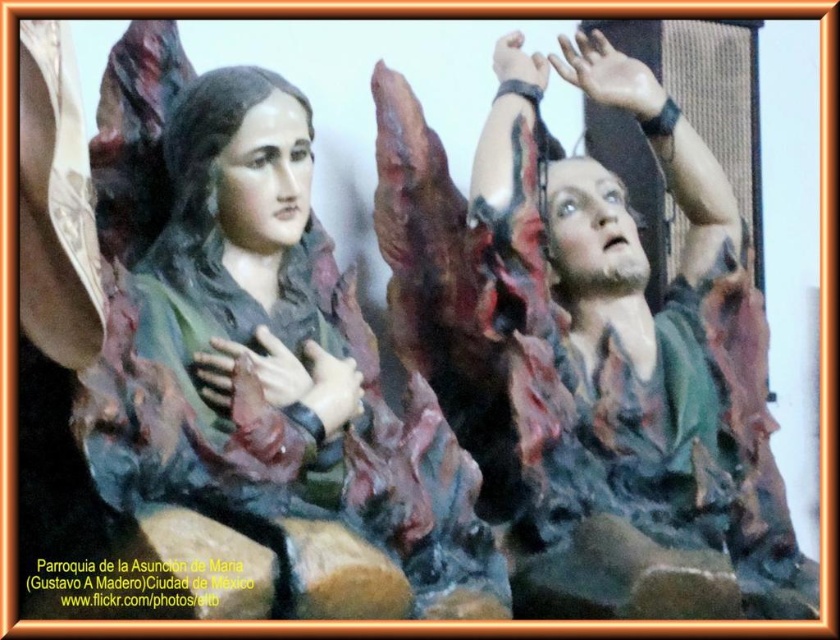
Question: Does smooth skin hand at upper right have a greater width compared to matte brown hand at upper center?

Choices:
 (A) yes
 (B) no

Answer: (A)

Question: Which of the following is the farthest from the observer?

Choices:
 (A) pos(177,557)
 (B) pos(602,397)
 (C) pos(538,81)

Answer: (C)

Question: Is smooth skin hand at upper right wider than matte brown hand at center?

Choices:
 (A) yes
 (B) no

Answer: (A)

Question: Which point appears closest to the camera in this image?

Choices:
 (A) (378, 605)
 (B) (336, 422)

Answer: (A)

Question: Can you confirm if brown matte stone at center is smaller than matte brown hand at upper center?

Choices:
 (A) yes
 (B) no

Answer: (B)

Question: Which point appears farthest from the camera in this image?

Choices:
 (A) (312, 376)
 (B) (465, 556)
 (C) (256, 573)

Answer: (B)